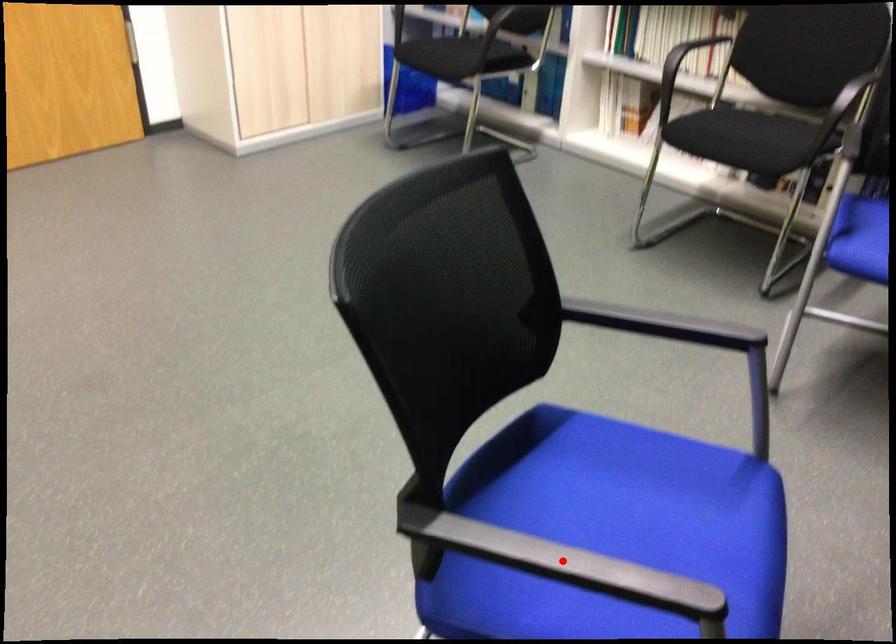
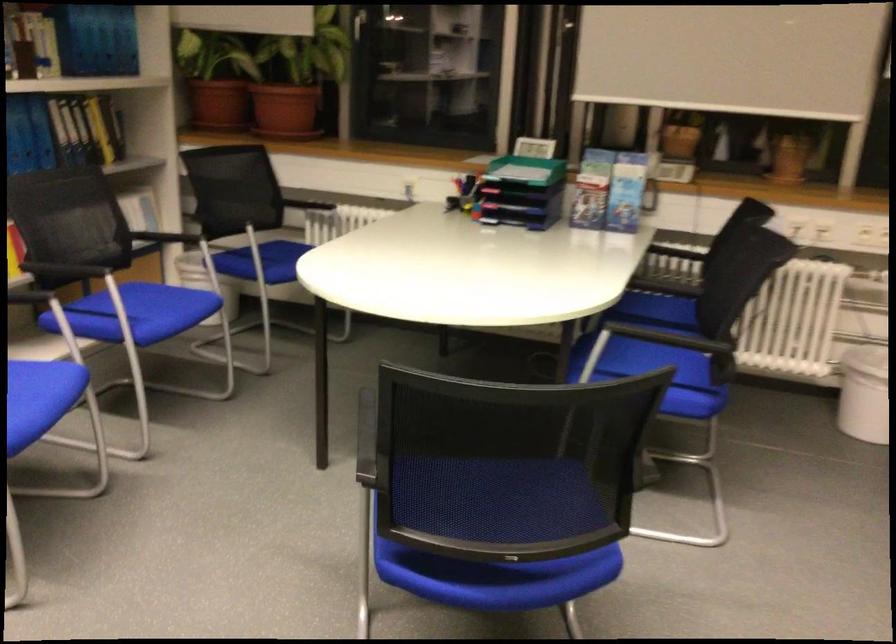
Question: I am providing you with two images of the same scene from different viewpoints. A red point is marked on the first image. Can you still see the location of the red point in image 2?

Choices:
 (A) Yes
 (B) No

Answer: (B)